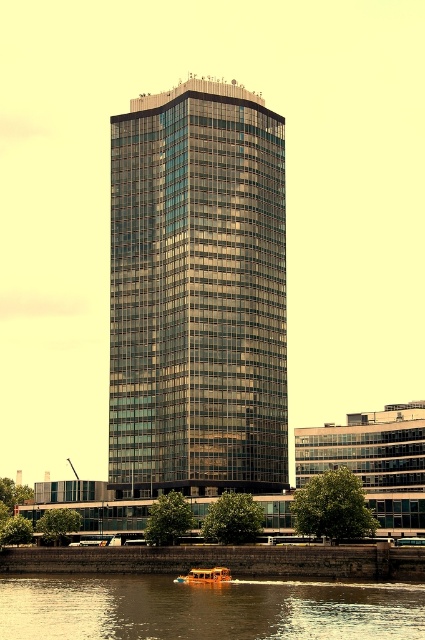
Question: Which of these objects is positioned closest to the orange polished wood boat at lower center?

Choices:
 (A) glassy metallic skyscraper at center
 (B) brown water at lower center

Answer: (B)

Question: Observing the image, what is the correct spatial positioning of glassy metallic skyscraper at center in reference to orange polished wood boat at lower center?

Choices:
 (A) right
 (B) left

Answer: (B)

Question: Which of these objects is positioned farthest from the glassy metallic skyscraper at center?

Choices:
 (A) orange polished wood boat at lower center
 (B) brown water at lower center

Answer: (A)

Question: Does brown water at lower center appear under orange polished wood boat at lower center?

Choices:
 (A) no
 (B) yes

Answer: (A)

Question: Which of the following is the farthest from the observer?

Choices:
 (A) orange polished wood boat at lower center
 (B) brown water at lower center
 (C) glassy metallic skyscraper at center

Answer: (C)

Question: Where is brown water at lower center located in relation to orange polished wood boat at lower center in the image?

Choices:
 (A) below
 (B) above

Answer: (B)